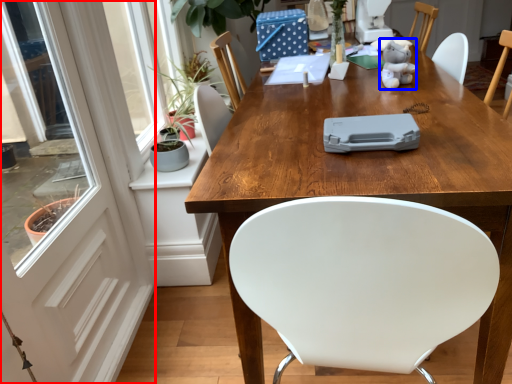
Question: Which of the following is the farthest to the observer, screen door (highlighted by a red box) or toy (highlighted by a blue box)?

Choices:
 (A) screen door
 (B) toy

Answer: (B)